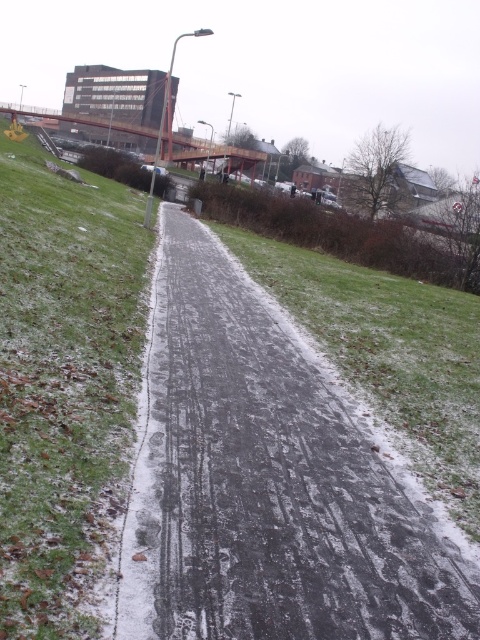
Question: From the image, what is the correct spatial relationship of slick asphalt road at center in relation to green grass at lower left?

Choices:
 (A) below
 (B) above

Answer: (A)

Question: Which of the following is the farthest from the observer?

Choices:
 (A) slick asphalt road at center
 (B) green grass at lower left

Answer: (A)

Question: In this image, where is slick asphalt road at center located relative to green grass at lower left?

Choices:
 (A) below
 (B) above

Answer: (A)

Question: Does slick asphalt road at center come behind green grass at lower left?

Choices:
 (A) no
 (B) yes

Answer: (B)